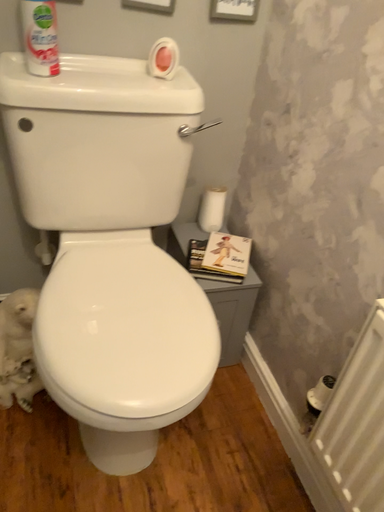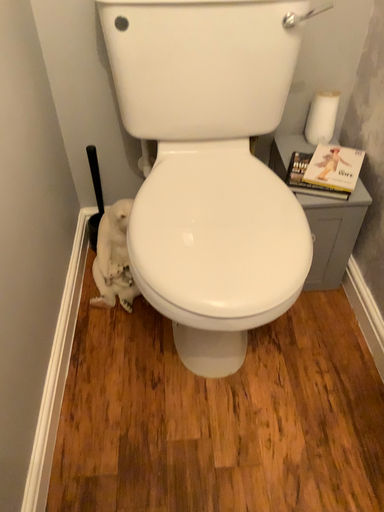
Question: Which way did the camera rotate in the video?

Choices:
 (A) rotated left
 (B) rotated right

Answer: (A)